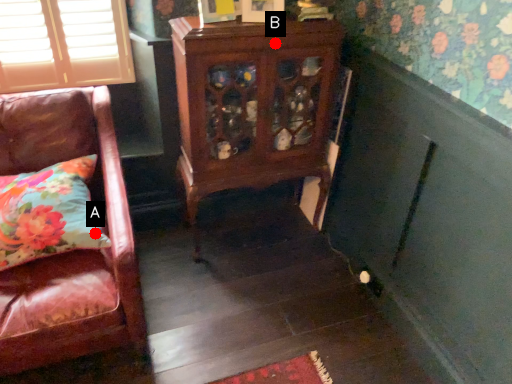
Question: Two points are circled on the image, labeled by A and B beside each circle. Which point is farther from the camera taking this photo?

Choices:
 (A) A is further
 (B) B is further

Answer: (B)